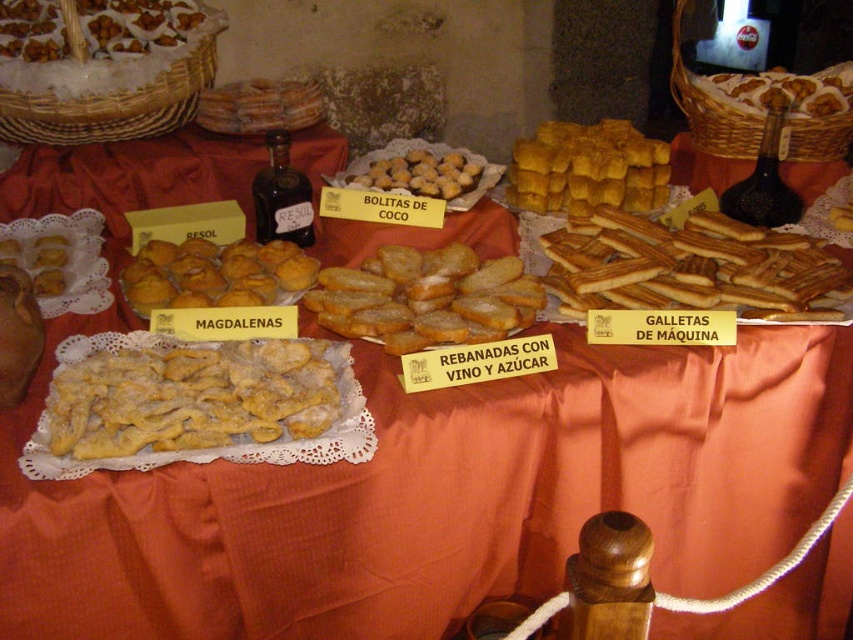
Question: Estimate the real-world distances between objects in this image. Which object is farther from the golden crispy balls at center?

Choices:
 (A) golden crumbly pastry at center
 (B) golden crumbly muffins at center
 (C) golden crispy pastry at upper right
 (D) golden crisp galletas at center

Answer: (C)

Question: Does golden fried pastry at center appear over matte brown pastry at center?

Choices:
 (A) yes
 (B) no

Answer: (B)

Question: Does golden crumbly muffins at center have a larger size compared to golden crispy pastry at upper right?

Choices:
 (A) yes
 (B) no

Answer: (B)

Question: Which point appears closest to the camera in this image?

Choices:
 (A) (204, 12)
 (B) (392, 332)
 (C) (198, 300)
 (D) (474, 172)

Answer: (B)

Question: Does golden crumbly pastry at center appear on the left side of brown crumbly pastry at upper left?

Choices:
 (A) yes
 (B) no

Answer: (B)

Question: Which object appears farthest from the camera in this image?

Choices:
 (A) sugared golden-brown bread slices at center
 (B) golden crumbly muffins at center

Answer: (B)